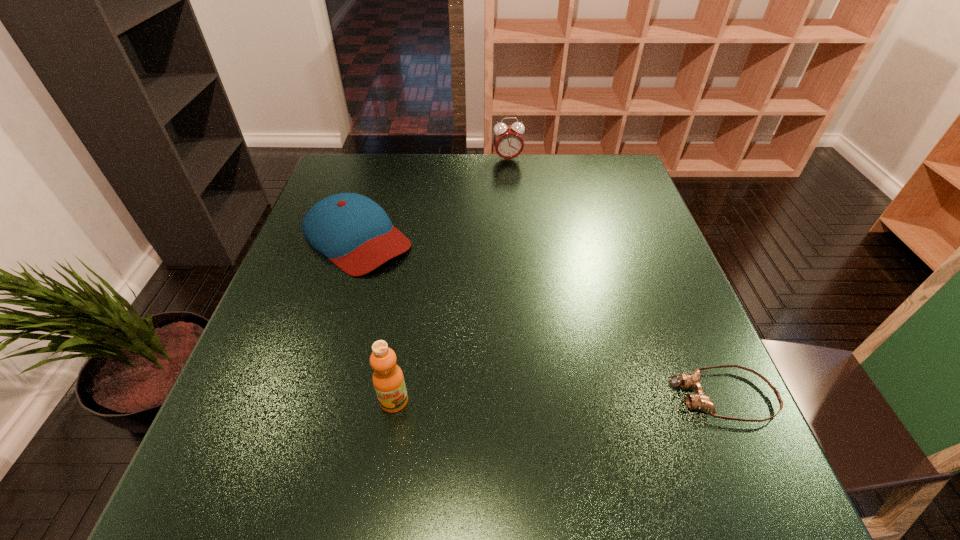
Locate an element on the screen. vacant space on the desktop that is between the tallest object and the goggles and is positioned on the clock face of the alarm clock is located at coordinates (571, 398).

The image size is (960, 540). Identify the location of free spot on the desktop that is between the orange juice and the shortest object and is positioned with the bill of the baseball cap facing forward. (547, 399).